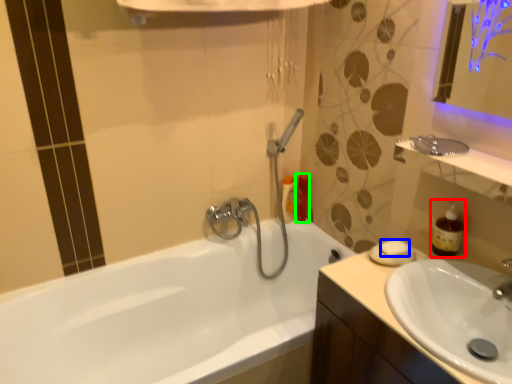
Question: Which object is positioned closest to soap dispenser (highlighted by a red box)? Select from soap (highlighted by a blue box) and toiletry (highlighted by a green box).

Choices:
 (A) soap
 (B) toiletry

Answer: (A)